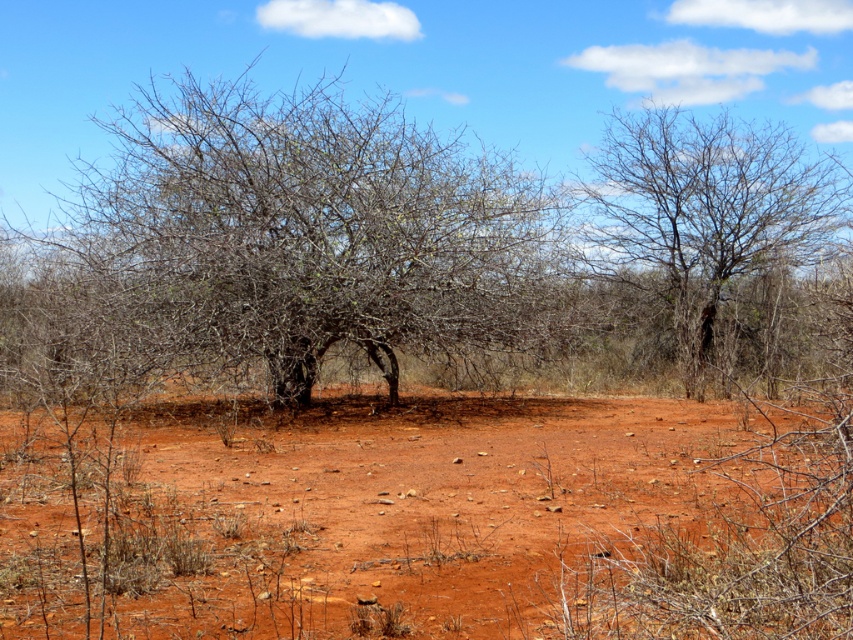
Which is in front, point (422, 321) or point (740, 124)?

Point (422, 321) is in front.

Which is more to the right, bare branches at center or bare branches at upper right?

Positioned to the right is bare branches at upper right.

Between point (207, 339) and point (624, 209), which one is positioned behind?

Point (624, 209)

You are a GUI agent. You are given a task and a screenshot of the screen. Output one action in this format:
    pyautogui.click(x=<x>, y=<y>)
    Task: Click on the bare branches at center
    
    Given the screenshot: What is the action you would take?
    pyautogui.click(x=296, y=240)

Is point (817, 465) more distant than point (699, 388)?

No, it is not.

Does dull reddish-brown soil at center appear under bare branches at upper right?

Yes, dull reddish-brown soil at center is below bare branches at upper right.

Locate an element on the screen. Image resolution: width=853 pixels, height=640 pixels. dull reddish-brown soil at center is located at coordinates [436, 522].

Which is more to the right, dull reddish-brown soil at center or bare branches at center?

Positioned to the right is dull reddish-brown soil at center.

Between point (56, 508) and point (407, 128), which one is positioned behind?

The point (407, 128) is behind.

Locate an element on the screen. dull reddish-brown soil at center is located at coordinates (436, 522).